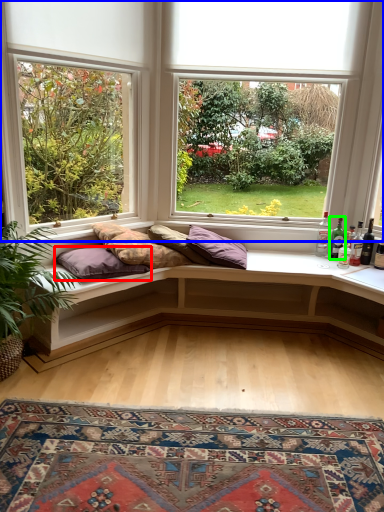
Question: Which object is positioned farthest from pillow (highlighted by a red box)? Select from window (highlighted by a blue box) and bottle (highlighted by a green box).

Choices:
 (A) window
 (B) bottle

Answer: (B)